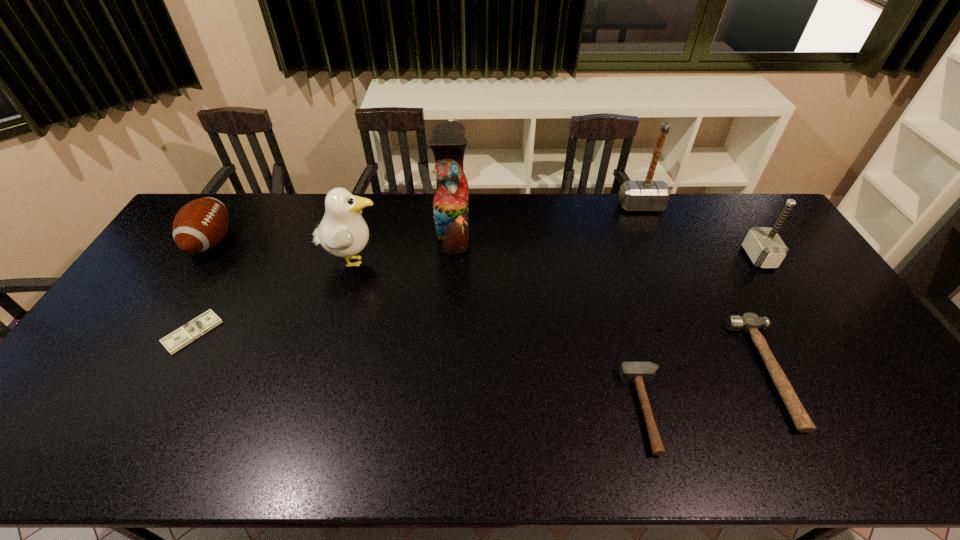
Locate an element on the screen. object that is at the far left corner is located at coordinates (199, 225).

Identify the location of vacant point at the far edge. (252, 224).

Image resolution: width=960 pixels, height=540 pixels. I want to click on free region at the near edge of the desktop, so click(771, 443).

In the image, there is a desktop. What are the coordinates of `free space at the left edge` in the screenshot? It's located at (169, 276).

At what (x,y) coordinates should I click in order to perform the action: click on vacant region at the right edge of the desktop. Please return your answer as a coordinate pair (x, y). The image size is (960, 540). Looking at the image, I should click on (860, 347).

In the image, there is a desktop. In order to click on vacant space at the far right corner in this screenshot , I will do `click(761, 222)`.

Locate an element on the screen. The image size is (960, 540). blank region between the shortest object and the fourth shortest object is located at coordinates (202, 287).

At what (x,y) coordinates should I click in order to perform the action: click on free point between the gull and the shortest object. Please return your answer as a coordinate pair (x, y). The height and width of the screenshot is (540, 960). Looking at the image, I should click on (272, 296).

You are a GUI agent. You are given a task and a screenshot of the screen. Output one action in this format:
    pyautogui.click(x=<x>, y=<y>)
    Task: Click on the vacant space that's between the shortest object and the fourth shortest object
    This screenshot has width=960, height=540.
    Given the screenshot: What is the action you would take?
    pyautogui.click(x=202, y=287)

You are a GUI agent. You are given a task and a screenshot of the screen. Output one action in this format:
    pyautogui.click(x=<x>, y=<y>)
    Task: Click on the blank region between the fifth object from left to right and the third shortest hammer
    Image resolution: width=960 pixels, height=540 pixels.
    Given the screenshot: What is the action you would take?
    pyautogui.click(x=703, y=334)